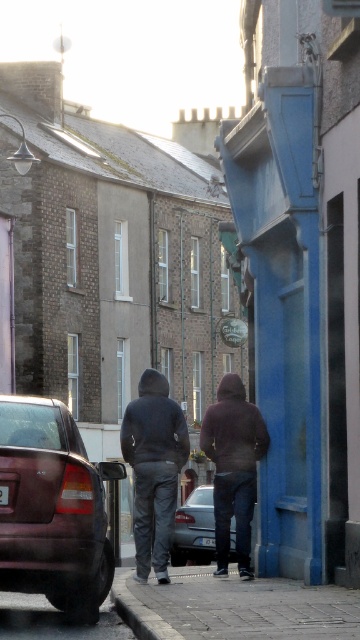
You are a pedestrian standing on the sidewalk and see the dark gray hoodie at center and the silver metallic sedan at center. Which object is closer to you?

The dark gray hoodie at center is closer to you because it is positioned over the silver metallic sedan at center, indicating it is in front of the car.

You are driving a delivery van and need to park between the shiny dark red sedan at left and the silver metallic sedan at center. Can you safely park there without blocking either vehicle?

The shiny dark red sedan at left is in front of the silver metallic sedan at center, so there is space between them for parking. Yes, you can park safely between them without blocking either vehicle.

You are standing on the quiet urban street and want to walk from the point at coordinates (236, 394) to the point at (195, 532). Which direction should you face to move towards your destination?

You should face towards the direction of point (195, 532), which is behind point (236, 394). Since point (236, 394) is in front of point (195, 532), you need to move backward to reach your destination.